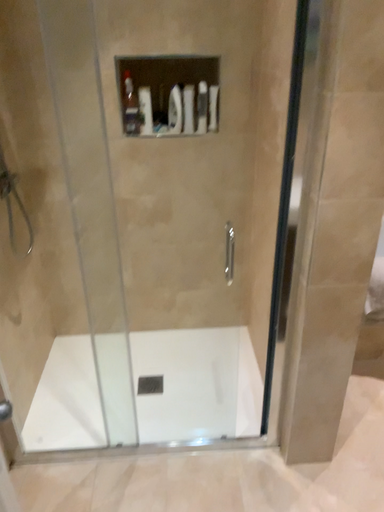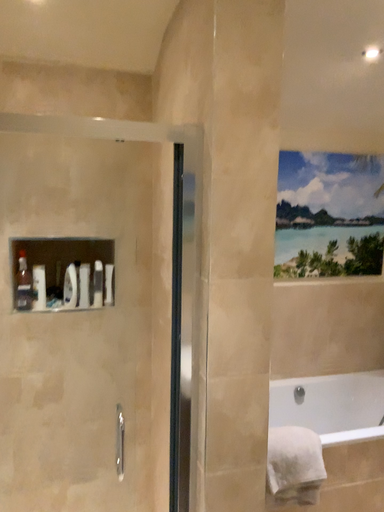
Question: Which way did the camera rotate in the video?

Choices:
 (A) rotated right
 (B) rotated left

Answer: (A)